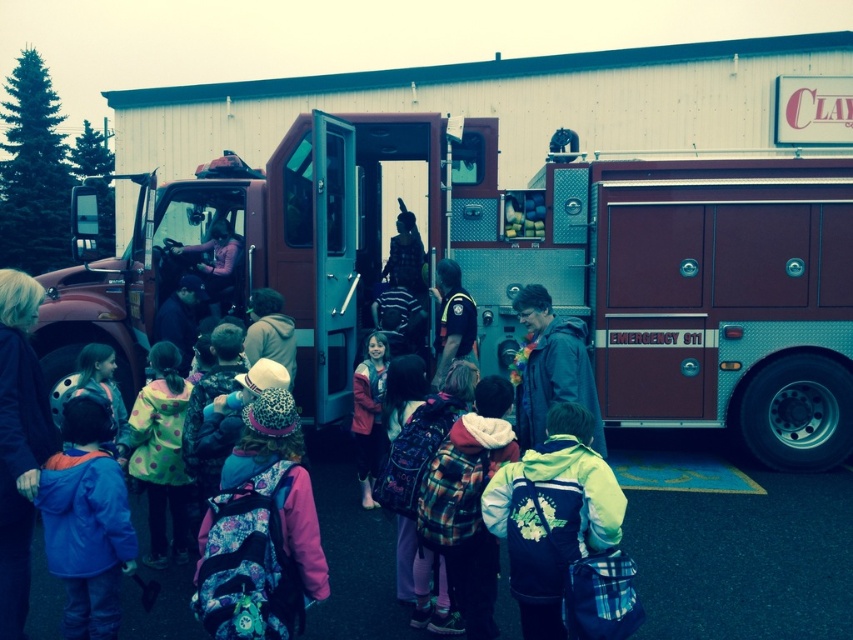
Question: Which object is closer to the camera taking this photo?

Choices:
 (A) maroon metallic fire truck at center
 (B) flannel shirt at center

Answer: (B)

Question: Does maroon metallic fire truck at center appear on the left side of polka dot fabric jacket at center?

Choices:
 (A) no
 (B) yes

Answer: (A)

Question: Does maroon metallic fire truck at center have a smaller size compared to flannel shirt at center?

Choices:
 (A) yes
 (B) no

Answer: (A)

Question: Is blue fleece jacket at lower left smaller than flannel shirt at center?

Choices:
 (A) no
 (B) yes

Answer: (B)

Question: Among these objects, which one is nearest to the camera?

Choices:
 (A) blue fleece jacket at lower left
 (B) maroon metallic fire truck at center
 (C) matte pink jacket at center

Answer: (A)

Question: Which of the following is the farthest from the observer?

Choices:
 (A) blue fleece jacket at lower left
 (B) dark blue jacket at center
 (C) matte pink jacket at center

Answer: (C)